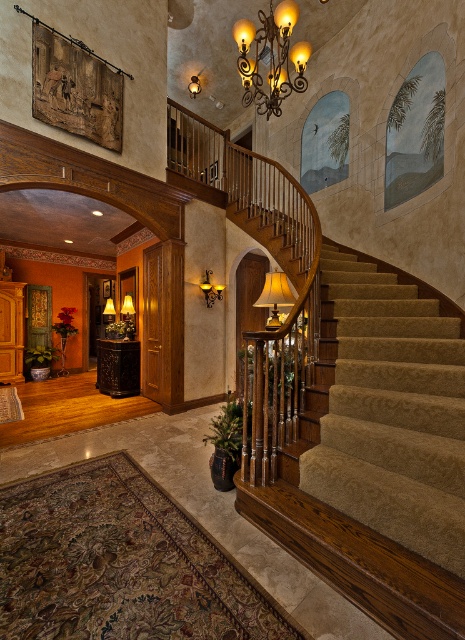
You are standing at the entrance of the mansion and want to reach the matte gold lamp at center to adjust its brightness. The carpeted stairs at center are in your path. Based on their positions, which object should you approach first?

You should approach the carpeted stairs at center first since it is closer to you than the matte gold lamp at center, allowing you to move towards the lamp afterward.

You are an interior designer assessing the space. You need to ensure that the matte black lampshade at upper center does not block the view of the carpeted stairs at center from the entrance. Based on their heights, is this possible?

The carpeted stairs at center is taller than the matte black lampshade at upper center, so the lampshade will not block the view of the stairs from the entrance since it is shorter.

You are standing in the entrance hall and want to place a new decorative item between the carpeted stairs at center and the matte gold lamp at center. Based on their current positions, which object should the item be closer to if you want it to be aligned with the left side of the room?

The item should be placed closer to the matte gold lamp at center because the carpeted stairs at center is positioned on the right side of the matte gold lamp at center, meaning the lamp is closer to the left side of the room.